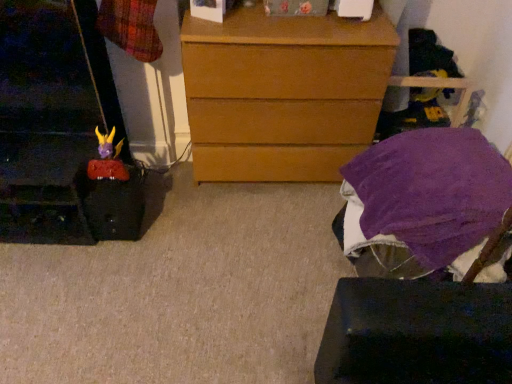
Question: From the image's perspective, is purple soft fabric at lower right on top of matte plastic toy at left?

Choices:
 (A) no
 (B) yes

Answer: (A)

Question: Does purple soft fabric at lower right come in front of matte plastic toy at left?

Choices:
 (A) no
 (B) yes

Answer: (B)

Question: Would you say purple soft fabric at lower right is a long distance from matte plastic toy at left?

Choices:
 (A) no
 (B) yes

Answer: (B)

Question: From a real-world perspective, is purple soft fabric at lower right positioned under matte plastic toy at left based on gravity?

Choices:
 (A) no
 (B) yes

Answer: (A)

Question: Does purple soft fabric at lower right have a lesser height compared to matte plastic toy at left?

Choices:
 (A) no
 (B) yes

Answer: (A)

Question: From the image's perspective, is purple fabric-covered stool at lower right located above or below matte plastic toy at left?

Choices:
 (A) above
 (B) below

Answer: (B)

Question: Visually, is purple fabric-covered stool at lower right positioned to the left or to the right of matte plastic toy at left?

Choices:
 (A) left
 (B) right

Answer: (B)

Question: Is point (394, 370) closer or farther from the camera than point (106, 153)?

Choices:
 (A) closer
 (B) farther

Answer: (A)

Question: From a real-world perspective, is purple fabric-covered stool at lower right positioned above or below matte plastic toy at left?

Choices:
 (A) below
 (B) above

Answer: (A)

Question: Considering the relative positions of purple soft fabric at lower right and purple fabric-covered stool at lower right in the image provided, is purple soft fabric at lower right to the left or to the right of purple fabric-covered stool at lower right?

Choices:
 (A) left
 (B) right

Answer: (B)

Question: From a real-world perspective, is purple soft fabric at lower right above or below purple fabric-covered stool at lower right?

Choices:
 (A) above
 (B) below

Answer: (A)

Question: Is purple soft fabric at lower right bigger or smaller than purple fabric-covered stool at lower right?

Choices:
 (A) small
 (B) big

Answer: (A)

Question: Is point (381, 185) closer or farther from the camera than point (416, 178)?

Choices:
 (A) farther
 (B) closer

Answer: (A)

Question: Visually, is purple fabric-covered stool at lower right positioned to the left or to the right of purple soft fabric at lower right?

Choices:
 (A) right
 (B) left

Answer: (B)

Question: Does point (485, 306) appear closer or farther from the camera than point (377, 218)?

Choices:
 (A) farther
 (B) closer

Answer: (B)